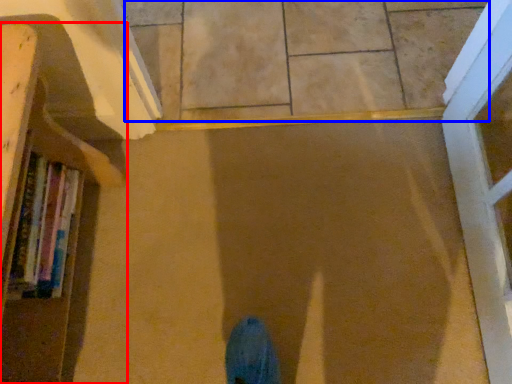
Question: Which point is closer to the camera, bookcase (highlighted by a red box) or tile (highlighted by a blue box)?

Choices:
 (A) bookcase
 (B) tile

Answer: (A)